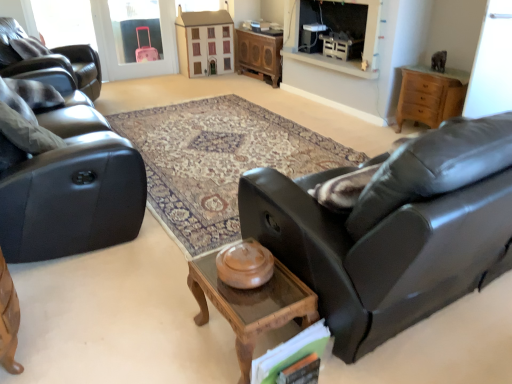
Identify the location of vacant area that lies between pink plastic suitcase at upper left and wooden glass coffee table at center. This screenshot has width=512, height=384. (172, 138).